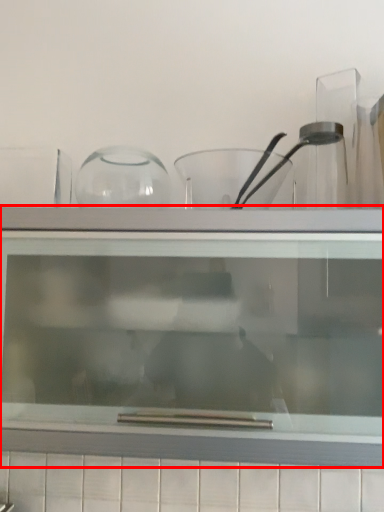
Question: In this image, where is shelf (annotated by the red box) located relative to bowl?

Choices:
 (A) right
 (B) left

Answer: (B)